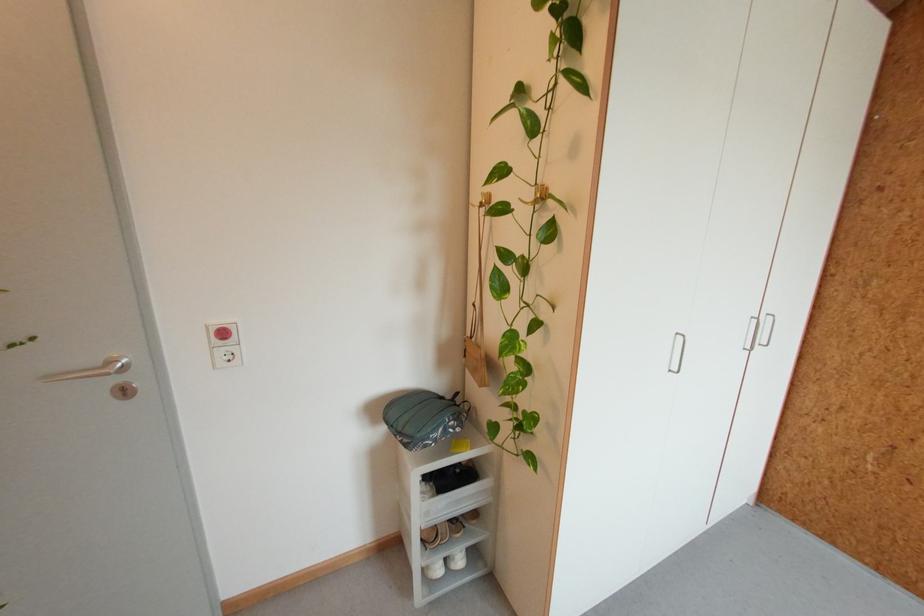
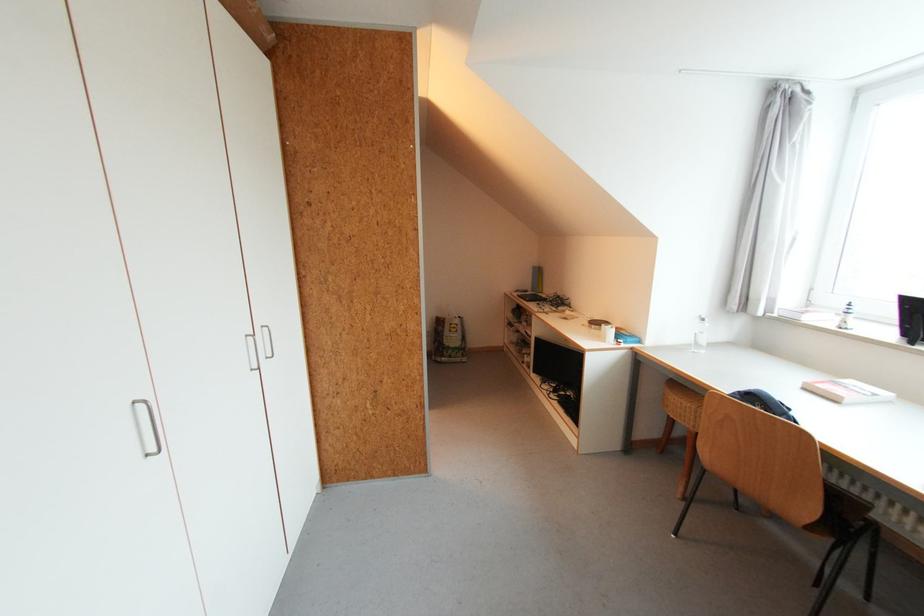
Find the pixel in the second image that matches point 675,371 in the first image.

(152, 456)